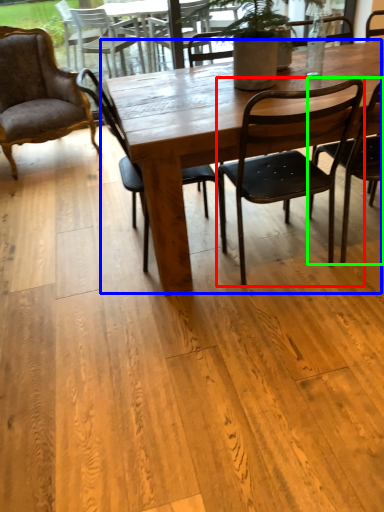
Question: Which object is the farthest from chair (highlighted by a red box)? Choose among these: kitchen & dining room table (highlighted by a blue box) or chair (highlighted by a green box).

Choices:
 (A) kitchen & dining room table
 (B) chair

Answer: (A)